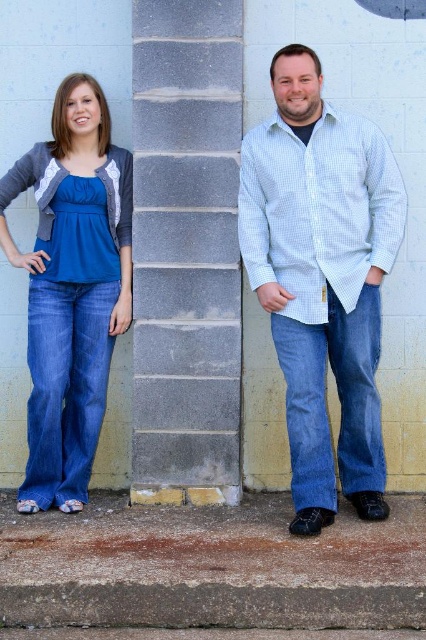
You are a photographer setting up a shoot in this scene. You need to ensure that the gray concrete pillar at center does not block the view of the matte blue jeans at left when taking a photo from the front. Can you position the camera so that the pillar is not in front of the jeans?

The gray concrete pillar at center is taller than the matte blue jeans at left, so positioning the camera at a lower angle would allow the jeans to be visible below the pillar without obstruction.

You are a photographer trying to capture the scene. You need to focus on the blue jeans at right and the matte blue jeans at left. Which pair of jeans is positioned higher in the frame?

The blue jeans at right is above matte blue jeans at left, so the blue jeans at right is positioned higher in the frame.